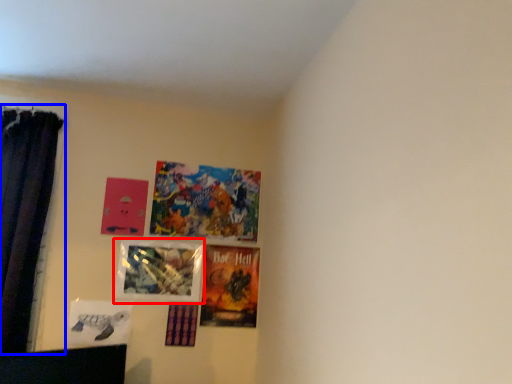
Question: Which point is closer to the camera, picture frame (highlighted by a red box) or curtain (highlighted by a blue box)?

Choices:
 (A) picture frame
 (B) curtain

Answer: (B)